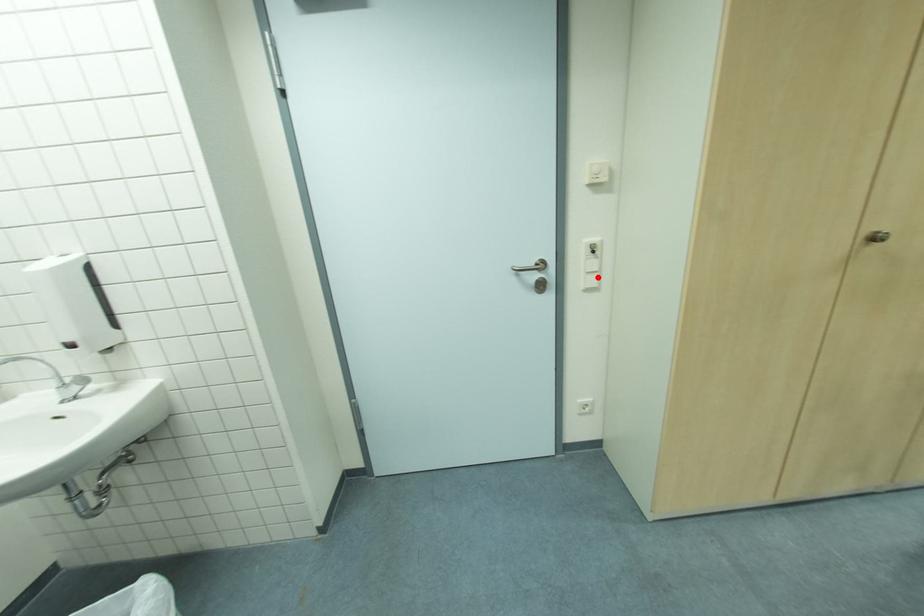
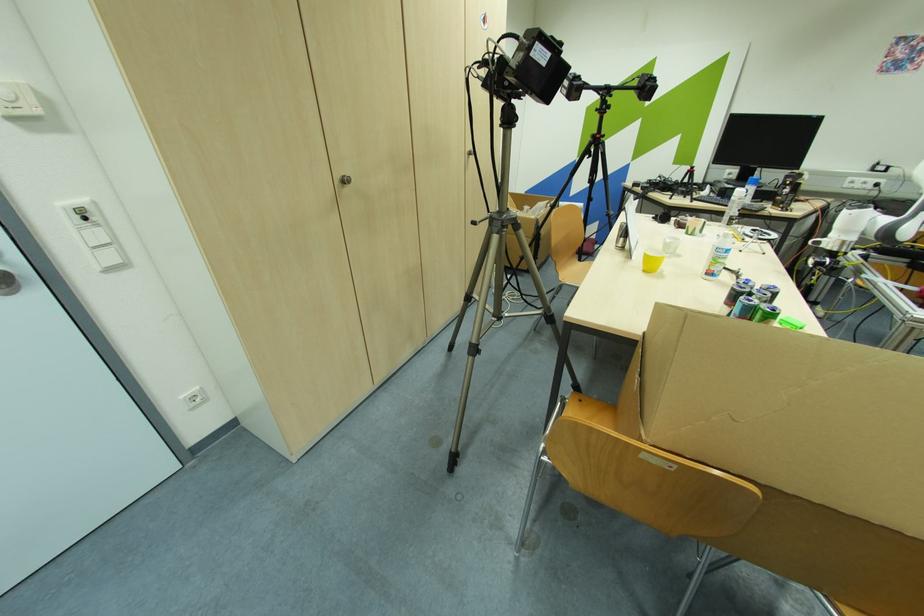
Where in the second image is the point corresponding to the highlighted location from the first image?

(116, 251)